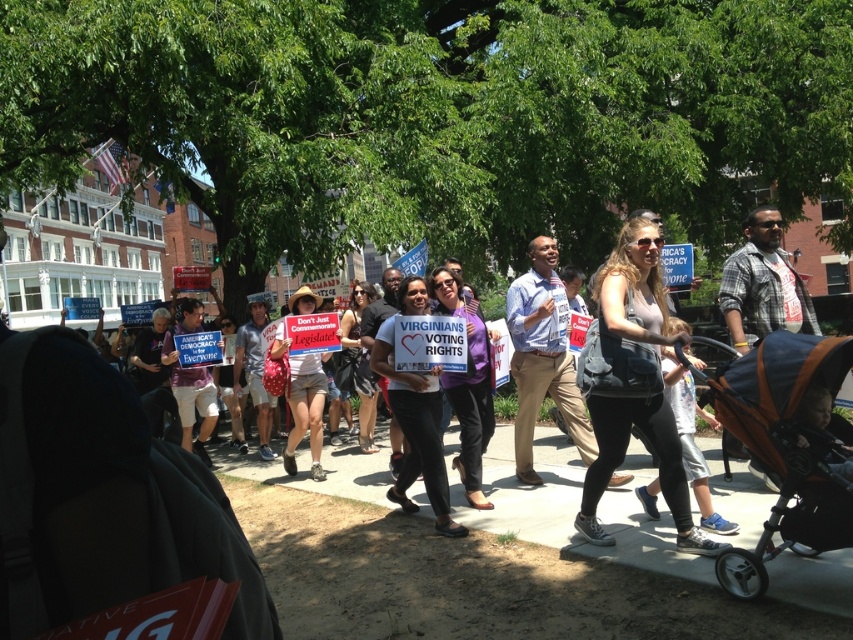
Is denim jacket at center to the right of purple fabric sign at center from the viewer's perspective?

Yes, denim jacket at center is to the right of purple fabric sign at center.

Is point (593, 349) positioned in front of point (408, 288)?

Yes, it is in front of point (408, 288).

Describe the element at coordinates (631, 381) in the screenshot. Image resolution: width=853 pixels, height=640 pixels. I see `denim jacket at center` at that location.

You are a GUI agent. You are given a task and a screenshot of the screen. Output one action in this format:
    pyautogui.click(x=<x>, y=<y>)
    Task: Click on the denim jacket at center
    This screenshot has width=853, height=640.
    Given the screenshot: What is the action you would take?
    pyautogui.click(x=631, y=381)

Which of these two, purple fabric sign at center or denim shorts at center, stands shorter?

Standing shorter between the two is denim shorts at center.

Who is more distant from viewer, (434,400) or (312,420)?

The point (312,420) is more distant.

At what (x,y) coordinates should I click in order to perform the action: click on purple fabric sign at center. Please return your answer as a coordinate pair (x, y). Image resolution: width=853 pixels, height=640 pixels. Looking at the image, I should click on (415, 413).

Does point (804, 476) come farther from viewer compared to point (297, 426)?

That is False.

Who is higher up, orange fabric stroller at lower right or denim shorts at center?

orange fabric stroller at lower right

Does point (804, 384) come closer to viewer compared to point (316, 464)?

Yes, it is in front of point (316, 464).

Where is `orange fabric stroller at lower right`? orange fabric stroller at lower right is located at coordinates (787, 448).